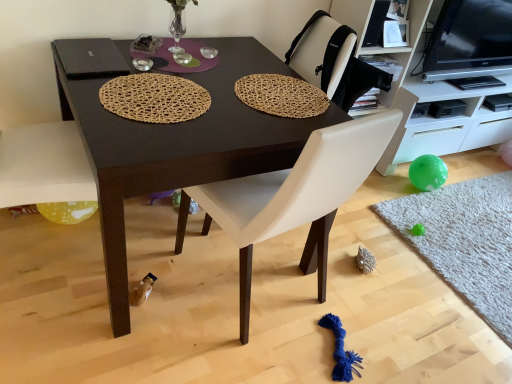
You are a GUI agent. You are given a task and a screenshot of the screen. Output one action in this format:
    pyautogui.click(x=<x>, y=<y>)
    Task: Click on the space that is in front of white leather chair at center
    
    Given the screenshot: What is the action you would take?
    pyautogui.click(x=218, y=354)